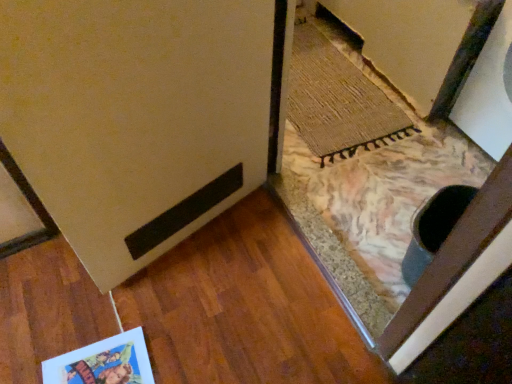
Locate an element on the screen. free spot below rug at lower right (from a real-world perspective) is located at coordinates (323, 86).